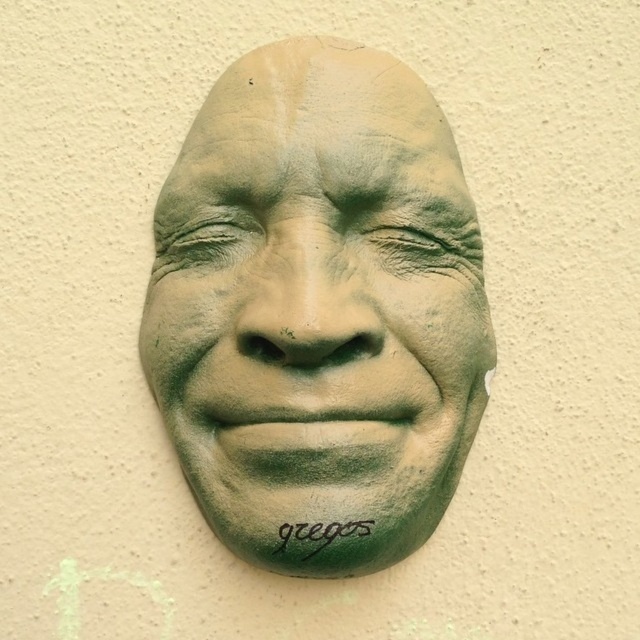
Question: Which point is farther from the camera taking this photo?

Choices:
 (A) (314, 531)
 (B) (365, 72)

Answer: (B)

Question: Does green clay mask at center come in front of green matte text at center?

Choices:
 (A) yes
 (B) no

Answer: (A)

Question: Is green clay mask at center thinner than green matte text at center?

Choices:
 (A) no
 (B) yes

Answer: (A)

Question: Which of the following is the closest to the observer?

Choices:
 (A) (346, 346)
 (B) (342, 531)

Answer: (B)

Question: In this image, where is green clay mask at center located relative to green matte text at center?

Choices:
 (A) below
 (B) above

Answer: (B)